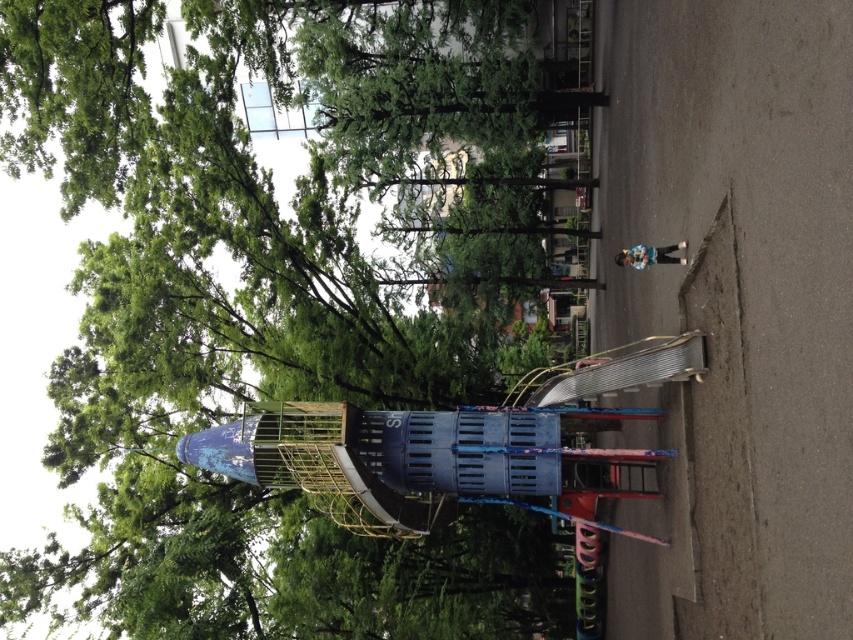
This screenshot has width=853, height=640. I want to click on green matte tree at upper left, so click(x=281, y=301).

Does green matte tree at upper left appear on the left side of metallic playground slide at center?

Correct, you'll find green matte tree at upper left to the left of metallic playground slide at center.

This screenshot has height=640, width=853. Find the location of `green matte tree at upper left`. green matte tree at upper left is located at coordinates (281, 301).